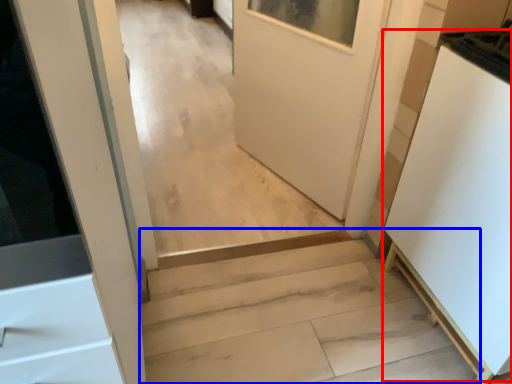
Question: Among these objects, which one is nearest to the camera, appliance (highlighted by a red box) or stairs (highlighted by a blue box)?

Choices:
 (A) appliance
 (B) stairs

Answer: (A)